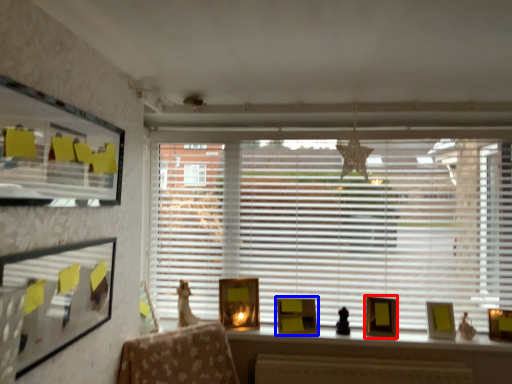
Question: Which object appears farthest to the camera in this image, picture frame (highlighted by a red box) or picture frame (highlighted by a blue box)?

Choices:
 (A) picture frame
 (B) picture frame

Answer: (B)